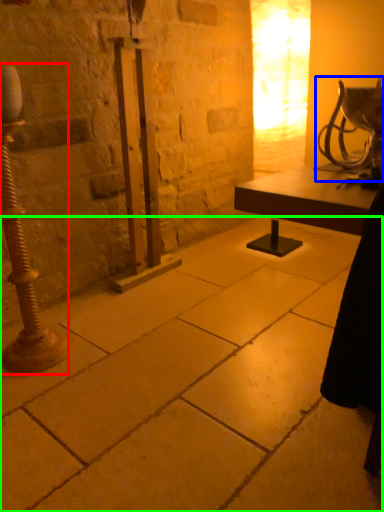
Question: Based on their relative distances, which object is farther from pillar (highlighted by a red box)? Choose from table lamp (highlighted by a blue box) and concrete (highlighted by a green box).

Choices:
 (A) table lamp
 (B) concrete

Answer: (A)